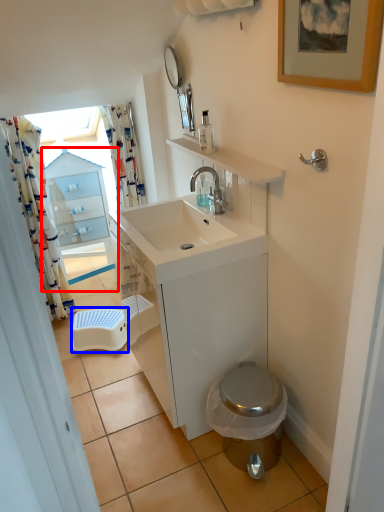
Question: Which object appears closest to the camera in this image, glass door (highlighted by a red box) or step stool (highlighted by a blue box)?

Choices:
 (A) glass door
 (B) step stool

Answer: (B)